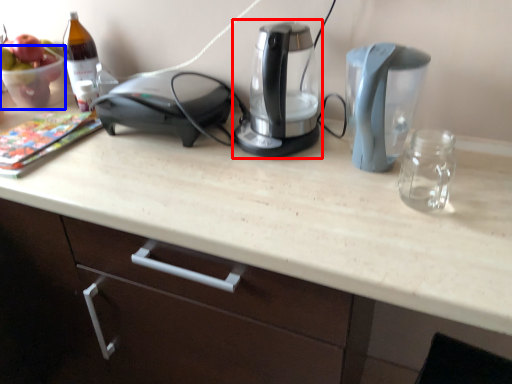
Question: Which point is closer to the camera, kitchen appliance (highlighted by a red box) or glass bowl (highlighted by a blue box)?

Choices:
 (A) kitchen appliance
 (B) glass bowl

Answer: (A)